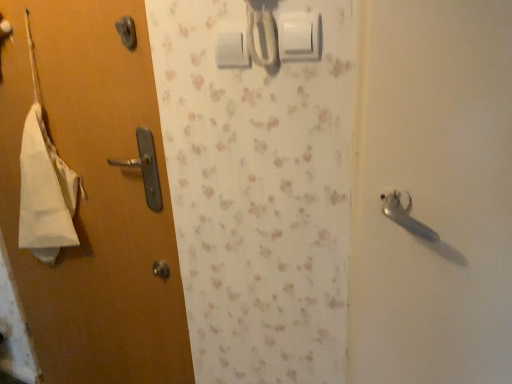
Find the location of `white plastic light switch at upper center, which is the first light switch in left-to-right order`. white plastic light switch at upper center, which is the first light switch in left-to-right order is located at coordinates (232, 50).

Identify the location of matte wood door at left. The width and height of the screenshot is (512, 384). (94, 200).

Which is further, (231, 44) or (53, 338)?

Positioned behind is point (53, 338).

Based on their positions, is white plastic light switch at upper center, which is the first light switch in left-to-right order, located to the left or right of matte wood door at left?

Clearly, white plastic light switch at upper center, which is the first light switch in left-to-right order, is on the right of matte wood door at left in the image.

From a real-world perspective, who is located higher, white plastic light switch at upper center, which is the 1th light switch in back-to-front order, or matte wood door at left?

From a 3D spatial view, white plastic light switch at upper center, which is the 1th light switch in back-to-front order, is above.

Is white plastic light switch at upper center, which is the 1th light switch in back-to-front order, positioned far away from matte wood door at left?

Actually, white plastic light switch at upper center, which is the 1th light switch in back-to-front order, and matte wood door at left are a little close together.

Is white plastic light switch at upper center, arranged as the second light switch when viewed from the front, with white plastic light switch at upper center, which is the 1th light switch in front-to-back order?

white plastic light switch at upper center, arranged as the second light switch when viewed from the front, is not next to white plastic light switch at upper center, which is the 1th light switch in front-to-back order, and they're not touching.

From a real-world perspective, which is physically below, white plastic light switch at upper center, arranged as the second light switch when viewed from the front, or white plastic light switch at upper center, acting as the first light switch starting from the right?

From a 3D spatial view, white plastic light switch at upper center, arranged as the second light switch when viewed from the front, is below.

Identify the location of light switch above the white plastic light switch at upper center, arranged as the second light switch when viewed from the front (from a real-world perspective). (298, 36).

In the scene shown: Can you tell me how much white plastic light switch at upper center, which is the 1th light switch in back-to-front order, and white plastic light switch at upper center, acting as the first light switch starting from the right, differ in facing direction?

0.538 degrees separate the facing orientations of white plastic light switch at upper center, which is the 1th light switch in back-to-front order, and white plastic light switch at upper center, acting as the first light switch starting from the right.

How many degrees apart are the facing directions of matte wood door at left and white plastic light switch at upper center, which is the 1th light switch in front-to-back order?

The angle between the facing direction of matte wood door at left and the facing direction of white plastic light switch at upper center, which is the 1th light switch in front-to-back order, is 0.627 degrees.

Between matte wood door at left and white plastic light switch at upper center, the 2th light switch in the left-to-right sequence, which one has smaller width?

white plastic light switch at upper center, the 2th light switch in the left-to-right sequence.

Considering the points (159, 250) and (287, 48), which point is behind, point (159, 250) or point (287, 48)?

The point (159, 250) is more distant.

From their relative heights in the image, would you say matte wood door at left is taller or shorter than white plastic light switch at upper center, acting as the first light switch starting from the right?

Considering their sizes, matte wood door at left has more height than white plastic light switch at upper center, acting as the first light switch starting from the right.

Which of these two, white plastic light switch at upper center, which is the 1th light switch in front-to-back order, or white plastic light switch at upper center, which is the first light switch in left-to-right order, stands taller?

With more height is white plastic light switch at upper center, which is the 1th light switch in front-to-back order.

The height and width of the screenshot is (384, 512). In order to click on light switch that is above the white plastic light switch at upper center, which is the second light switch in back-to-front order (from the image's perspective) in this screenshot , I will do `click(232, 50)`.

Are white plastic light switch at upper center, acting as the first light switch starting from the right, and white plastic light switch at upper center, arranged as the second light switch when viewed from the front, beside each other?

They are not placed beside each other.

Which is behind, white plastic light switch at upper center, which is the 1th light switch in front-to-back order, or white plastic light switch at upper center, arranged as the second light switch when viewed from the front?

Positioned behind is white plastic light switch at upper center, arranged as the second light switch when viewed from the front.

Find the location of a particular element. This screenshot has width=512, height=384. door behind the white plastic light switch at upper center, the 2th light switch in the left-to-right sequence is located at coordinates (94, 200).

Is white plastic light switch at upper center, the 2th light switch in the left-to-right sequence, positioned beyond the bounds of matte wood door at left?

Indeed, white plastic light switch at upper center, the 2th light switch in the left-to-right sequence, is completely outside matte wood door at left.

From a real-world perspective, who is located lower, white plastic light switch at upper center, which is the second light switch in back-to-front order, or matte wood door at left?

matte wood door at left is physically lower.

How distant is matte wood door at left from white plastic light switch at upper center, which is the 1th light switch in back-to-front order?

The distance of matte wood door at left from white plastic light switch at upper center, which is the 1th light switch in back-to-front order, is 73.35 centimeters.

From the image's perspective, between matte wood door at left and white plastic light switch at upper center, which is the 1th light switch in back-to-front order, who is located below?

matte wood door at left appears lower in the image.

Does point (150, 343) come farther from viewer compared to point (244, 58)?

Yes, it is behind point (244, 58).

Is matte wood door at left inside or outside of white plastic light switch at upper center, which is the first light switch in left-to-right order?

matte wood door at left is not inside white plastic light switch at upper center, which is the first light switch in left-to-right order, it's outside.

Where is `the 1st light switch directly above the matte wood door at left (from a real-world perspective)`? The height and width of the screenshot is (384, 512). the 1st light switch directly above the matte wood door at left (from a real-world perspective) is located at coordinates (232, 50).

At what (x,y) coordinates should I click in order to perform the action: click on light switch located below the white plastic light switch at upper center, marked as the 2th light switch in a right-to-left arrangement (from the image's perspective). Please return your answer as a coordinate pair (x, y). This screenshot has width=512, height=384. Looking at the image, I should click on (298, 36).

From the picture: Looking at the image, which one is located further to matte wood door at left, white plastic light switch at upper center, which is the first light switch in left-to-right order, or white plastic light switch at upper center, which is the second light switch in back-to-front order?

white plastic light switch at upper center, which is the second light switch in back-to-front order, is further to matte wood door at left.

Considering their positions, is matte wood door at left positioned closer to white plastic light switch at upper center, which is the 1th light switch in back-to-front order, than white plastic light switch at upper center, acting as the first light switch starting from the right?

Among the two, white plastic light switch at upper center, acting as the first light switch starting from the right, is located nearer to white plastic light switch at upper center, which is the 1th light switch in back-to-front order.

Looking at the image, which one is located further to white plastic light switch at upper center, which is the 1th light switch in front-to-back order, white plastic light switch at upper center, arranged as the second light switch when viewed from the front, or matte wood door at left?

matte wood door at left.

When comparing their distances from matte wood door at left, does white plastic light switch at upper center, which is the 1th light switch in front-to-back order, or white plastic light switch at upper center, which is the 1th light switch in back-to-front order, seem closer?

The object closer to matte wood door at left is white plastic light switch at upper center, which is the 1th light switch in back-to-front order.

Based on their spatial positions, is matte wood door at left or white plastic light switch at upper center, arranged as the second light switch when viewed from the front, closer to white plastic light switch at upper center, which is the second light switch in back-to-front order?

Among the two, white plastic light switch at upper center, arranged as the second light switch when viewed from the front, is located nearer to white plastic light switch at upper center, which is the second light switch in back-to-front order.

Based on their spatial positions, is white plastic light switch at upper center, the 2th light switch in the left-to-right sequence, or matte wood door at left further from white plastic light switch at upper center, which is the first light switch in left-to-right order?

matte wood door at left.

Where is `light switch situated between matte wood door at left and white plastic light switch at upper center, the 2th light switch in the left-to-right sequence, from left to right`? light switch situated between matte wood door at left and white plastic light switch at upper center, the 2th light switch in the left-to-right sequence, from left to right is located at coordinates (232, 50).